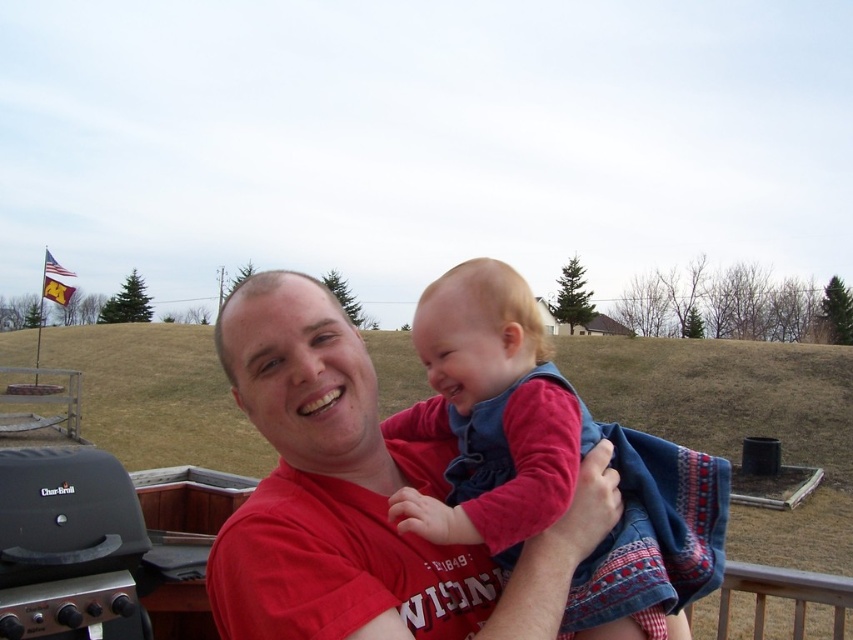
Can you confirm if velvety blue dress at center is smaller than black matte grill at lower left?

Actually, velvety blue dress at center might be larger than black matte grill at lower left.

Between point (526, 310) and point (50, 520), which one is positioned in front?

Positioned in front is point (526, 310).

Measure the distance between point (543,324) and camera.

A distance of 1.84 meters exists between point (543,324) and camera.

This screenshot has width=853, height=640. In order to click on velvety blue dress at center in this screenshot , I will do `click(486, 400)`.